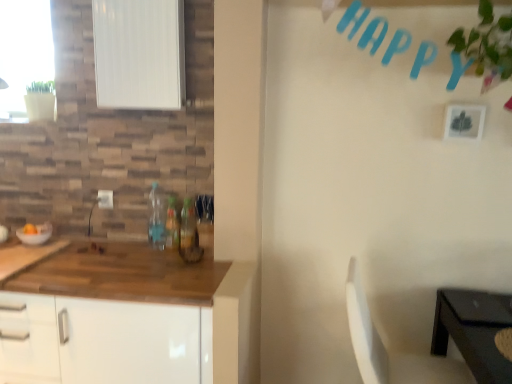
Find the location of a particular element. The image size is (512, 384). vacant point to the right of white glossy bowl at left is located at coordinates (74, 244).